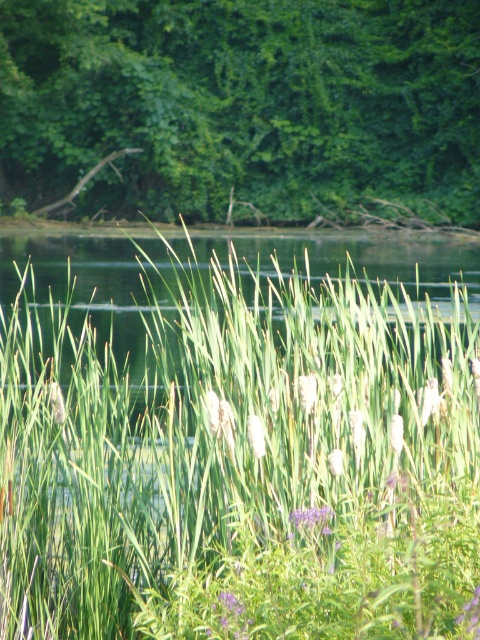
Question: Is green grass at center below green leafy tree at upper center?

Choices:
 (A) no
 (B) yes

Answer: (B)

Question: Which object appears farthest from the camera in this image?

Choices:
 (A) green leafy tree at upper center
 (B) green grass at center

Answer: (A)

Question: Is green grass at center to the right of green leafy tree at upper center from the viewer's perspective?

Choices:
 (A) no
 (B) yes

Answer: (B)

Question: In this image, where is green grass at center located relative to green leafy tree at upper center?

Choices:
 (A) above
 (B) below

Answer: (B)

Question: Among these points, which one is nearest to the camera?

Choices:
 (A) (347, 483)
 (B) (261, 202)

Answer: (A)